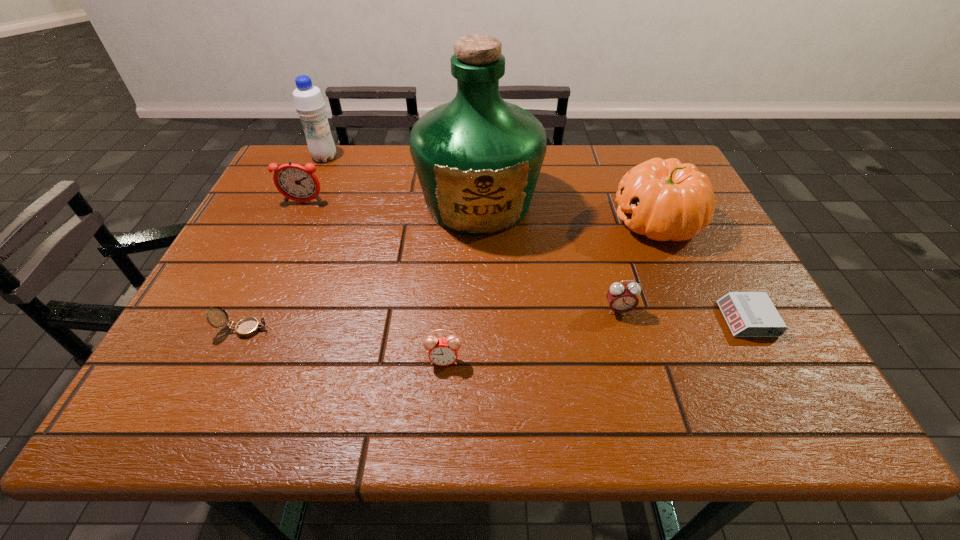
Locate an element on the screen. Image resolution: width=960 pixels, height=540 pixels. the tallest object is located at coordinates (x=478, y=158).

Identify the location of the seventh shortest object. The image size is (960, 540). (308, 100).

Locate an element on the screen. The width and height of the screenshot is (960, 540). the farthest object is located at coordinates (308, 100).

You are a GUI agent. You are given a task and a screenshot of the screen. Output one action in this format:
    pyautogui.click(x=<x>, y=<y>)
    Task: Click on the pumpkin
    This screenshot has height=540, width=960.
    Given the screenshot: What is the action you would take?
    pyautogui.click(x=664, y=200)

Locate an element on the screen. the tallest alarm clock is located at coordinates (295, 182).

Where is `the farthest alarm clock`? the farthest alarm clock is located at coordinates (295, 182).

The height and width of the screenshot is (540, 960). In order to click on the third alarm clock from left to right in this screenshot , I will do `click(622, 298)`.

This screenshot has width=960, height=540. I want to click on the second alarm clock from left to right, so click(443, 351).

Where is `the nearest alarm clock`? the nearest alarm clock is located at coordinates (443, 351).

The width and height of the screenshot is (960, 540). Identify the location of the second shortest object. (247, 327).